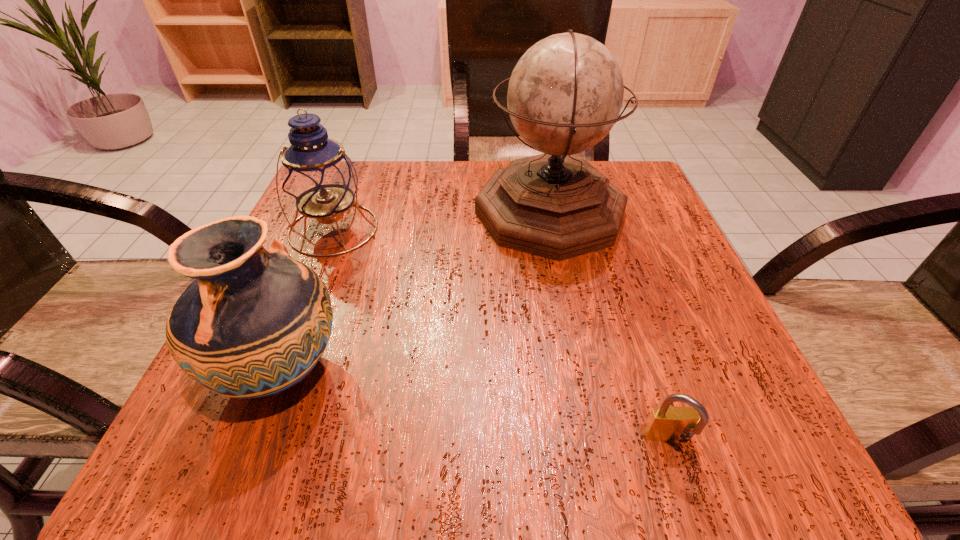
Where is `vacant space in between the lantern and the tallest object`? The image size is (960, 540). vacant space in between the lantern and the tallest object is located at coordinates (442, 221).

Locate an element on the screen. The height and width of the screenshot is (540, 960). vacant area between the tallest object and the pottery is located at coordinates (415, 292).

The image size is (960, 540). I want to click on free space that is in between the globe and the padlock, so click(x=610, y=327).

Identify the location of object that stands as the closest to the pottery. The height and width of the screenshot is (540, 960). (318, 177).

Locate which object is the third closest to the lantern. Please provide its 2D coordinates. Your answer should be formatted as a tuple, i.e. [(x, y)], where the tuple contains the x and y coordinates of a point satisfying the conditions above.

[(667, 424)]

In order to click on vacant space that satisfies the following two spatial constraints: 1. on the surface of the tallest object; 2. on the front side of the pottery in this screenshot , I will do `click(582, 372)`.

Image resolution: width=960 pixels, height=540 pixels. Find the location of `vacant space that satisfies the following two spatial constraints: 1. on the front-facing side of the lantern; 2. on the left side of the pottery`. vacant space that satisfies the following two spatial constraints: 1. on the front-facing side of the lantern; 2. on the left side of the pottery is located at coordinates (276, 372).

Find the location of a particular element. The height and width of the screenshot is (540, 960). free spot that satisfies the following two spatial constraints: 1. on the surface of the globe; 2. on the front-facing side of the lantern is located at coordinates (553, 229).

Where is `blank space that satisfies the following two spatial constraints: 1. on the surface of the tallest object; 2. on the front-facing side of the lantern`? Image resolution: width=960 pixels, height=540 pixels. blank space that satisfies the following two spatial constraints: 1. on the surface of the tallest object; 2. on the front-facing side of the lantern is located at coordinates (553, 229).